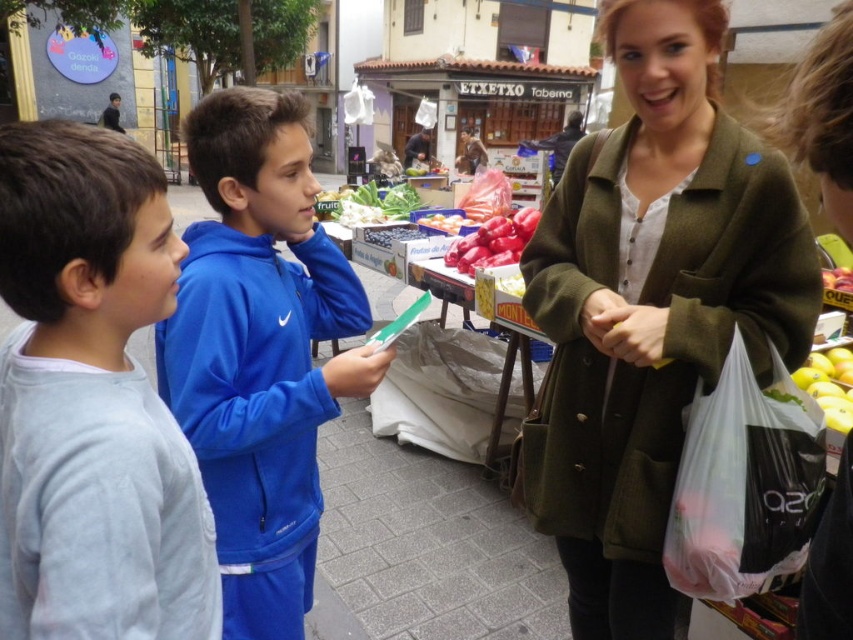
Question: Does green woolen coat at center appear under light gray cotton shirt at left?

Choices:
 (A) no
 (B) yes

Answer: (B)

Question: Among these points, which one is nearest to the camera?

Choices:
 (A) (648, 29)
 (B) (480, 264)

Answer: (A)

Question: Where is green woolen coat at center located in relation to light gray cotton shirt at left in the image?

Choices:
 (A) right
 (B) left

Answer: (A)

Question: Can you confirm if green woolen coat at center is wider than light gray cotton shirt at left?

Choices:
 (A) no
 (B) yes

Answer: (B)

Question: Which object is farther from the camera taking this photo?

Choices:
 (A) green leafy vegetables at center
 (B) red matte tomatoes at center
 (C) green woolen coat at center
 (D) light gray cotton shirt at left

Answer: (A)

Question: Which point is farther to the camera?

Choices:
 (A) (618, 202)
 (B) (403, 205)
 (C) (367, 353)
 (D) (135, 396)

Answer: (B)